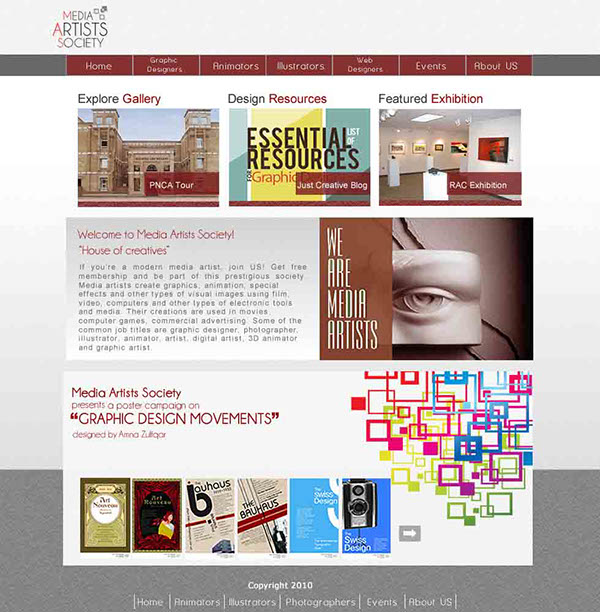
Identify the location of picture frames. This screenshot has height=612, width=600. (496, 147), (458, 147), (440, 149), (418, 152), (400, 149).